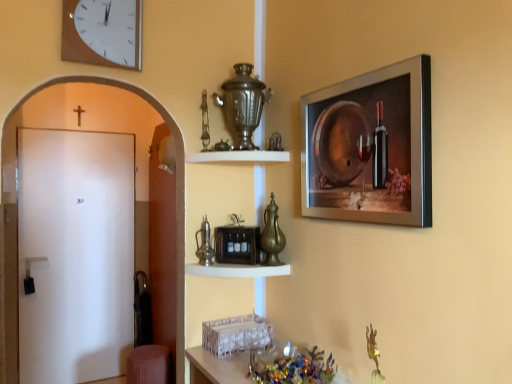
Question: Is there a large distance between white glossy shelf at upper center, which appears as the first shelf when viewed from the top, and metallic black toaster at center, which is counted as the 1th shelf, starting from the bottom?

Choices:
 (A) no
 (B) yes

Answer: (A)

Question: Is the depth of white glossy shelf at upper center, marked as the 2th shelf in a bottom-to-top arrangement, less than that of metallic black toaster at center, which is counted as the 1th shelf, starting from the bottom?

Choices:
 (A) yes
 (B) no

Answer: (B)

Question: Is white glossy shelf at upper center, marked as the 2th shelf in a bottom-to-top arrangement, further to the viewer compared to metallic black toaster at center, the 2th shelf in the top-to-bottom sequence?

Choices:
 (A) no
 (B) yes

Answer: (B)

Question: From a real-world perspective, is white glossy shelf at upper center, marked as the 2th shelf in a bottom-to-top arrangement, positioned under metallic black toaster at center, which is counted as the 1th shelf, starting from the bottom, based on gravity?

Choices:
 (A) no
 (B) yes

Answer: (A)

Question: Is white glossy shelf at upper center, marked as the 2th shelf in a bottom-to-top arrangement, at the right side of metallic black toaster at center, the 2th shelf in the top-to-bottom sequence?

Choices:
 (A) yes
 (B) no

Answer: (B)

Question: Is white matte door at left bigger or smaller than metallic glass bowl at lower center?

Choices:
 (A) big
 (B) small

Answer: (A)

Question: Is white matte door at left to the left or to the right of metallic glass bowl at lower center in the image?

Choices:
 (A) left
 (B) right

Answer: (A)

Question: Choose the correct answer: Is white matte door at left inside metallic glass bowl at lower center or outside it?

Choices:
 (A) inside
 (B) outside

Answer: (B)

Question: In the image, is white matte door at left positioned in front of or behind metallic glass bowl at lower center?

Choices:
 (A) behind
 (B) front

Answer: (A)

Question: Considering the positions of white matte door at left and gold metallic vase at center in the image, is white matte door at left wider or thinner than gold metallic vase at center?

Choices:
 (A) wide
 (B) thin

Answer: (B)

Question: In terms of size, does white matte door at left appear bigger or smaller than gold metallic vase at center?

Choices:
 (A) big
 (B) small

Answer: (A)

Question: In the image, is white matte door at left on the left side or the right side of gold metallic vase at center?

Choices:
 (A) right
 (B) left

Answer: (B)

Question: Is white matte door at left taller or shorter than gold metallic vase at center?

Choices:
 (A) tall
 (B) short

Answer: (A)

Question: Is point (402, 79) positioned closer to the camera than point (225, 360)?

Choices:
 (A) closer
 (B) farther

Answer: (A)

Question: Considering the positions of silver metallic picture frame at upper right and metallic glass bowl at lower center in the image, is silver metallic picture frame at upper right taller or shorter than metallic glass bowl at lower center?

Choices:
 (A) tall
 (B) short

Answer: (A)